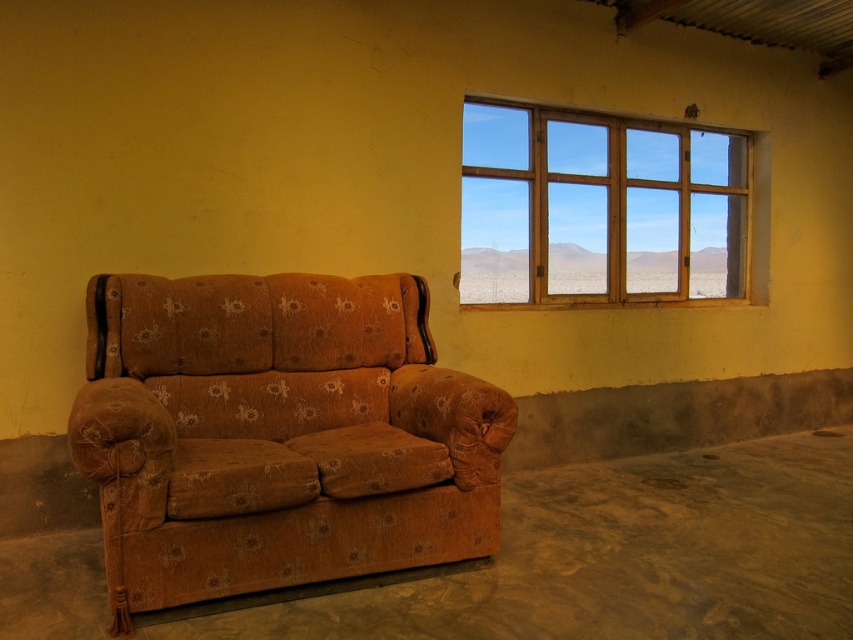
Can you confirm if brown floral fabric couch at lower left is positioned to the right of wooden window at upper right?

No, brown floral fabric couch at lower left is not to the right of wooden window at upper right.

Based on the photo, is brown floral fabric couch at lower left bigger than wooden window at upper right?

Actually, brown floral fabric couch at lower left might be smaller than wooden window at upper right.

Is point (323, 403) closer to camera compared to point (671, 244)?

Yes.

Find the location of a particular element. brown floral fabric couch at lower left is located at coordinates (277, 435).